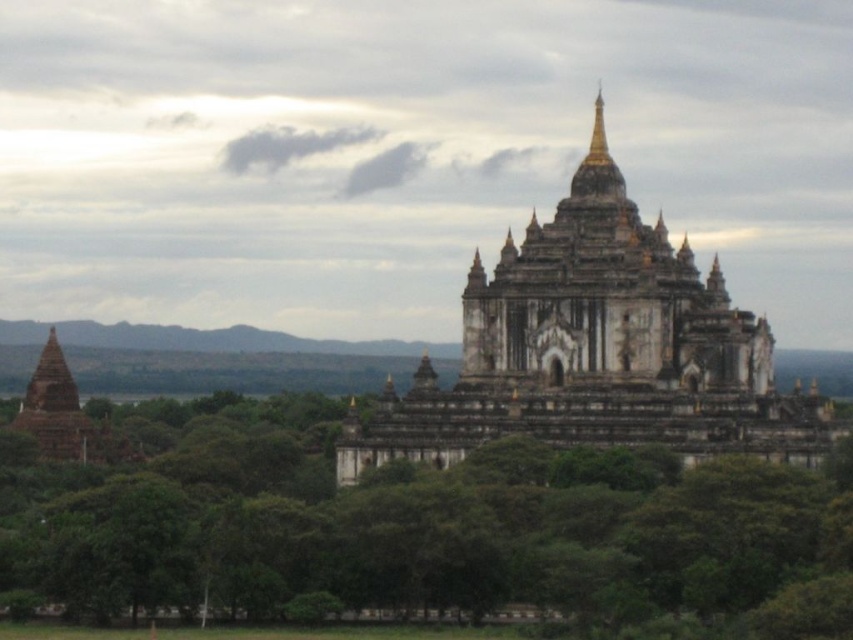
You are standing at the center of the image and want to locate the white stone pagoda at center. According to the coordinates provided, where exactly is it positioned?

The white stone pagoda at center is positioned at coordinates point (596, 349).

You are standing in front of the ancient temple complex and notice two points marked in the scene. The first point is at coordinate point (x=416, y=486) and the second is at point (x=74, y=390). Which point is closer to you?

Point (x=416, y=486) is closer to the viewer than point (x=74, y=390).